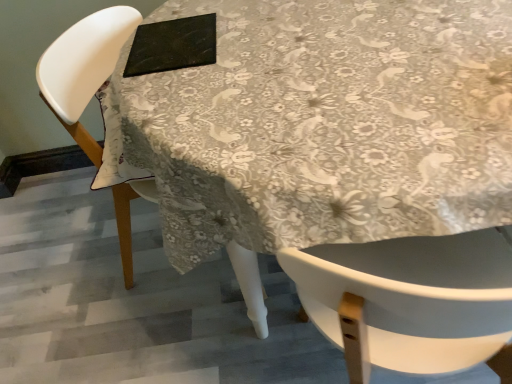
Find the location of a particular element. free space above black matte pad at upper center (from a real-world perspective) is located at coordinates (167, 36).